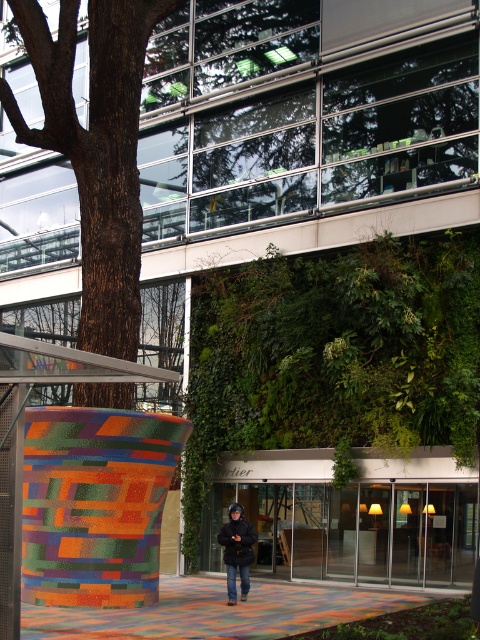
Does brown rough bark tree at left appear under black matte jacket at center?

Incorrect, brown rough bark tree at left is not positioned below black matte jacket at center.

Which is in front, point (119, 385) or point (248, 557)?

Point (248, 557) is in front.

Find the location of a particular element. Image resolution: width=480 pixels, height=640 pixels. brown rough bark tree at left is located at coordinates (96, 148).